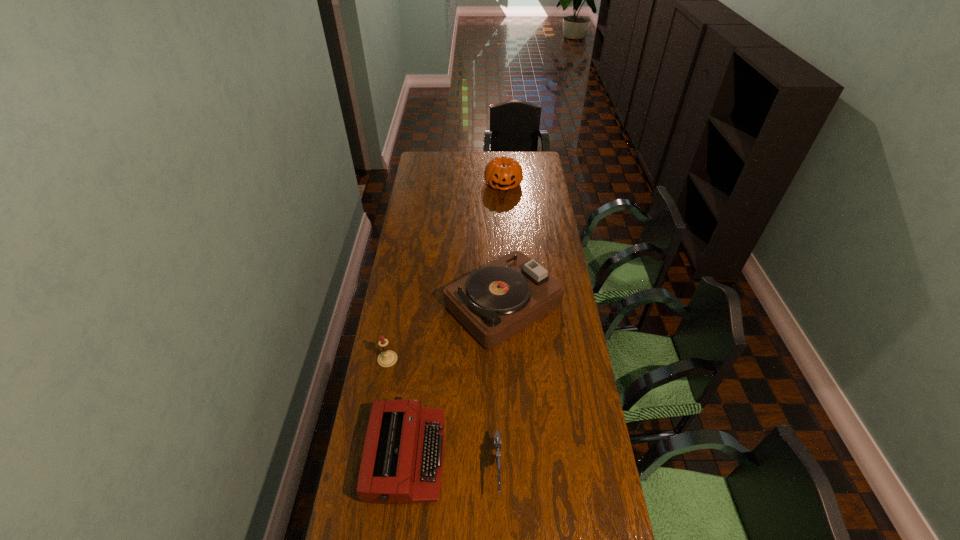
At what (x,y) coordinates should I click in order to perform the action: click on candle at the left edge. Please return your answer as a coordinate pair (x, y). Looking at the image, I should click on (387, 358).

The width and height of the screenshot is (960, 540). In order to click on typewriter located at the left edge in this screenshot , I will do `click(402, 460)`.

You are a GUI agent. You are given a task and a screenshot of the screen. Output one action in this format:
    pyautogui.click(x=<x>, y=<y>)
    Task: Click on the pumpkin situated at the right edge
    The width and height of the screenshot is (960, 540).
    Given the screenshot: What is the action you would take?
    pyautogui.click(x=503, y=173)

This screenshot has height=540, width=960. I want to click on record player that is at the right edge, so click(495, 302).

Identify the location of object that is at the far right corner. This screenshot has height=540, width=960. 503,173.

The height and width of the screenshot is (540, 960). I want to click on free space at the far edge of the desktop, so click(458, 161).

Identify the location of free point at the left edge. (413, 233).

Where is `free space at the right edge of the desktop`? free space at the right edge of the desktop is located at coordinates (550, 246).

Find the location of a particular element. The height and width of the screenshot is (540, 960). free location at the far right corner is located at coordinates (538, 160).

Where is `unoccupied area between the third farthest object and the pumpkin`? The image size is (960, 540). unoccupied area between the third farthest object and the pumpkin is located at coordinates (445, 272).